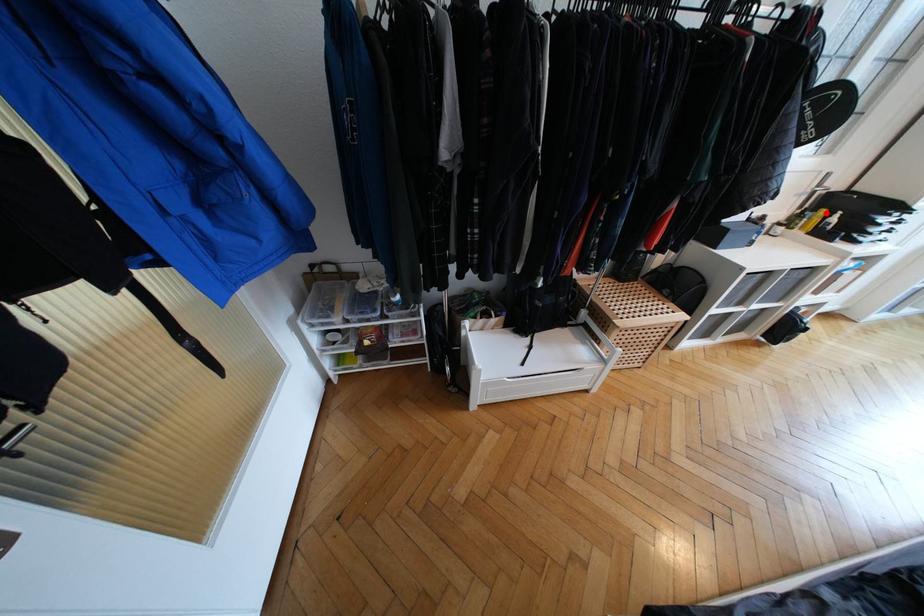
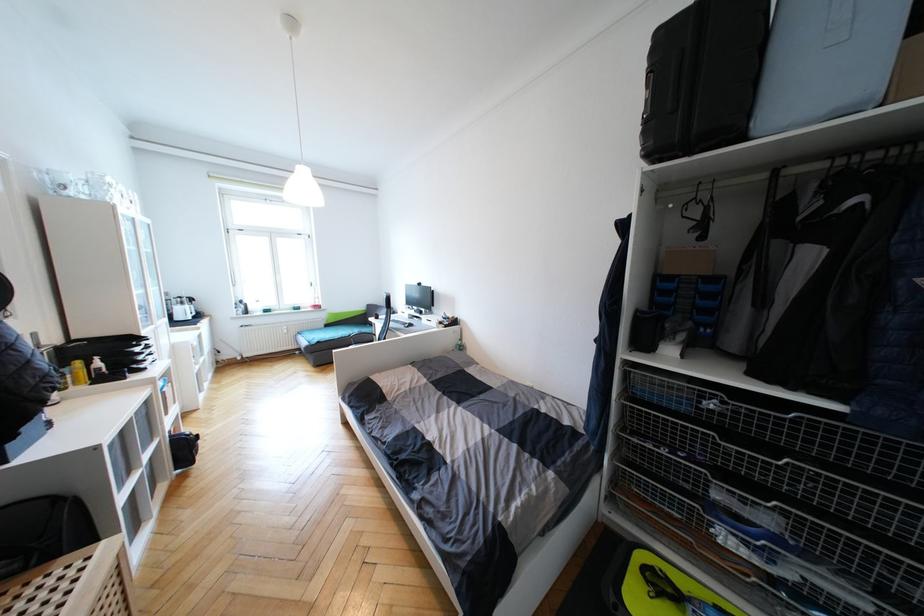
Question: I am providing you with two images of the same scene from different viewpoints. A red point is shown in image1. For the corresponding object point in image2, is it positioned nearer or farther from the camera?

Choices:
 (A) Nearer
 (B) Farther

Answer: (B)